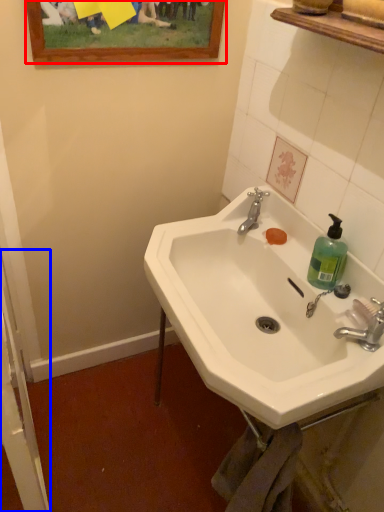
Question: Which point is further to the camera, picture frame (highlighted by a red box) or screen door (highlighted by a blue box)?

Choices:
 (A) picture frame
 (B) screen door

Answer: (A)